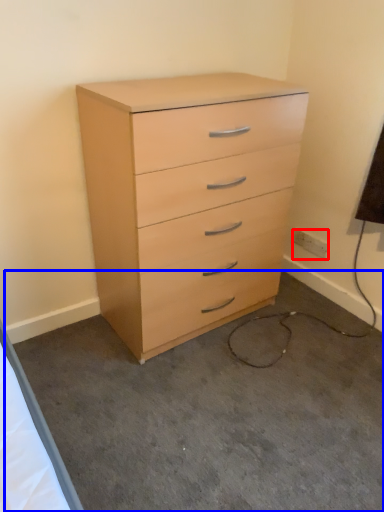
Question: Which object is closer to the camera taking this photo, electric outlet (highlighted by a red box) or concrete (highlighted by a blue box)?

Choices:
 (A) electric outlet
 (B) concrete

Answer: (B)